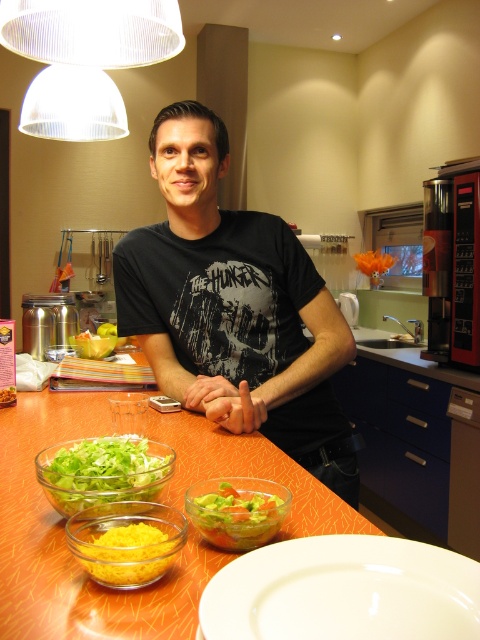
Question: Among these points, which one is farthest from the camera?

Choices:
 (A) (244, 506)
 (B) (392, 412)
 (C) (290, 621)
 (D) (169, 516)

Answer: (B)

Question: Which object is positioned closest to the yellow matte bowl at lower left?

Choices:
 (A) orange glossy table at center
 (B) translucent glass bowl at center

Answer: (B)

Question: Where is yellow matte bowl at lower left located in relation to dark wood drawer at lower right in the image?

Choices:
 (A) right
 (B) left

Answer: (B)

Question: Which point is closer to the camera taking this photo?

Choices:
 (A) (298, 356)
 (B) (192, 552)
 (C) (38, 476)
 (D) (228, 541)

Answer: (D)

Question: Can you confirm if black matte t-shirt at center is bigger than translucent glass bowl at center?

Choices:
 (A) yes
 (B) no

Answer: (A)

Question: Does black matte t-shirt at center appear on the right side of translucent glass bowl at center?

Choices:
 (A) no
 (B) yes

Answer: (A)